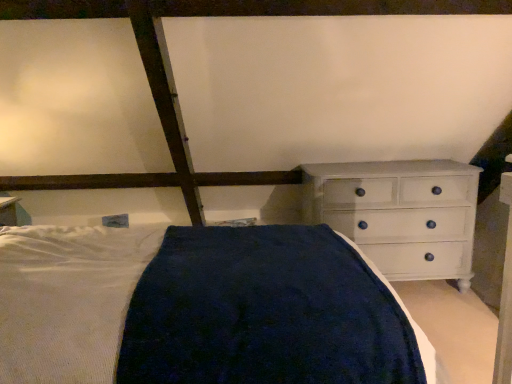
Where is `white painted wood chest of drawers at right`? The width and height of the screenshot is (512, 384). white painted wood chest of drawers at right is located at coordinates (400, 214).

The image size is (512, 384). What do you see at coordinates (400, 214) in the screenshot?
I see `white painted wood chest of drawers at right` at bounding box center [400, 214].

Image resolution: width=512 pixels, height=384 pixels. I want to click on white painted wood chest of drawers at right, so click(400, 214).